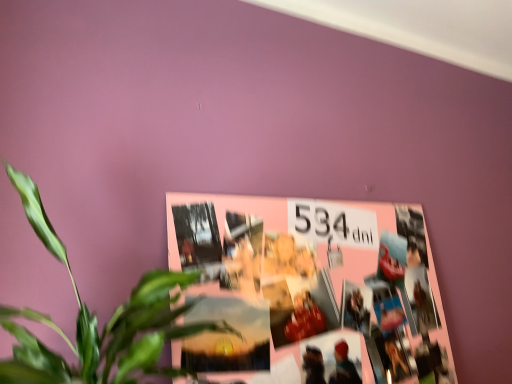
Question: From the image's perspective, is pink paper collage at upper center above or below green leafy plant at center?

Choices:
 (A) above
 (B) below

Answer: (B)

Question: Would you say pink paper collage at upper center is inside or outside green leafy plant at center?

Choices:
 (A) outside
 (B) inside

Answer: (A)

Question: Considering their positions, is pink paper collage at upper center located in front of or behind green leafy plant at center?

Choices:
 (A) behind
 (B) front

Answer: (A)

Question: Based on their positions, is green leafy plant at center located to the left or right of pink paper collage at upper center?

Choices:
 (A) left
 (B) right

Answer: (A)

Question: From the image's perspective, is green leafy plant at center located above or below pink paper collage at upper center?

Choices:
 (A) below
 (B) above

Answer: (B)

Question: Is green leafy plant at center inside or outside of pink paper collage at upper center?

Choices:
 (A) inside
 (B) outside

Answer: (B)

Question: In terms of width, does green leafy plant at center look wider or thinner when compared to pink paper collage at upper center?

Choices:
 (A) thin
 (B) wide

Answer: (B)